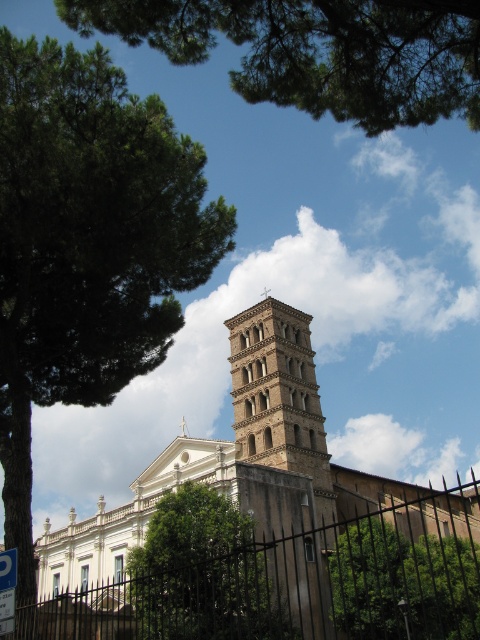
Which of these two, black metal fence at lower center or green leafy tree at upper left, stands taller?

With more height is black metal fence at lower center.

In the scene shown: Does black metal fence at lower center appear under green leafy tree at upper left?

Yes, black metal fence at lower center is below green leafy tree at upper left.

Locate an element on the screen. black metal fence at lower center is located at coordinates (300, 582).

Between green leafy tree at upper left and green leafy tree at center, which one has more height?

Standing taller between the two is green leafy tree at center.

This screenshot has width=480, height=640. I want to click on green leafy tree at upper left, so click(317, 51).

I want to click on green leafy tree at upper left, so click(317, 51).

Identify the location of green leafy tree at upper left. (317, 51).

Does green leafy tree at left have a greater height compared to green leafy tree at upper left?

Indeed, green leafy tree at left has a greater height compared to green leafy tree at upper left.

Between point (73, 310) and point (225, 13), which one is positioned behind?

The point (73, 310) is more distant.

You are a GUI agent. You are given a task and a screenshot of the screen. Output one action in this format:
    pyautogui.click(x=<x>, y=<y>)
    Task: Click on the green leafy tree at left
    Image resolution: width=480 pixels, height=640 pixels.
    Given the screenshot: What is the action you would take?
    [86, 244]